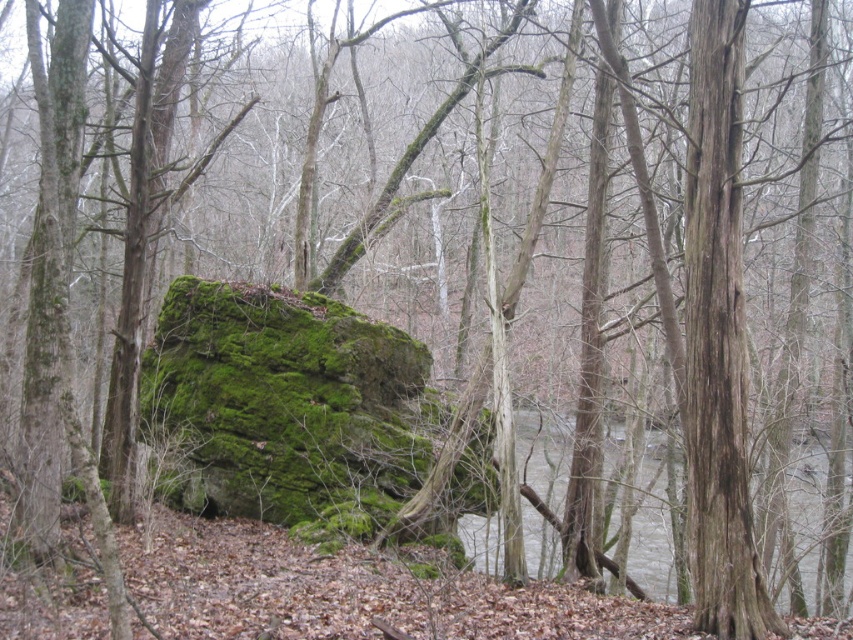
Question: Is brown rough tree trunk at right smaller than gray/wooden river at lower center?

Choices:
 (A) no
 (B) yes

Answer: (B)

Question: Can you confirm if brown rough tree trunk at right is smaller than gray/wooden river at lower center?

Choices:
 (A) no
 (B) yes

Answer: (B)

Question: Can you confirm if green mossy rock at center is positioned to the right of gray/wooden river at lower center?

Choices:
 (A) yes
 (B) no

Answer: (B)

Question: Which point is farther from the camera taking this photo?

Choices:
 (A) (535, 538)
 (B) (689, 365)

Answer: (A)

Question: Which point appears closest to the camera in this image?

Choices:
 (A) tap(636, 547)
 (B) tap(341, 465)

Answer: (B)

Question: Which of the following is the closest to the observer?

Choices:
 (A) (520, 440)
 (B) (699, 198)

Answer: (B)